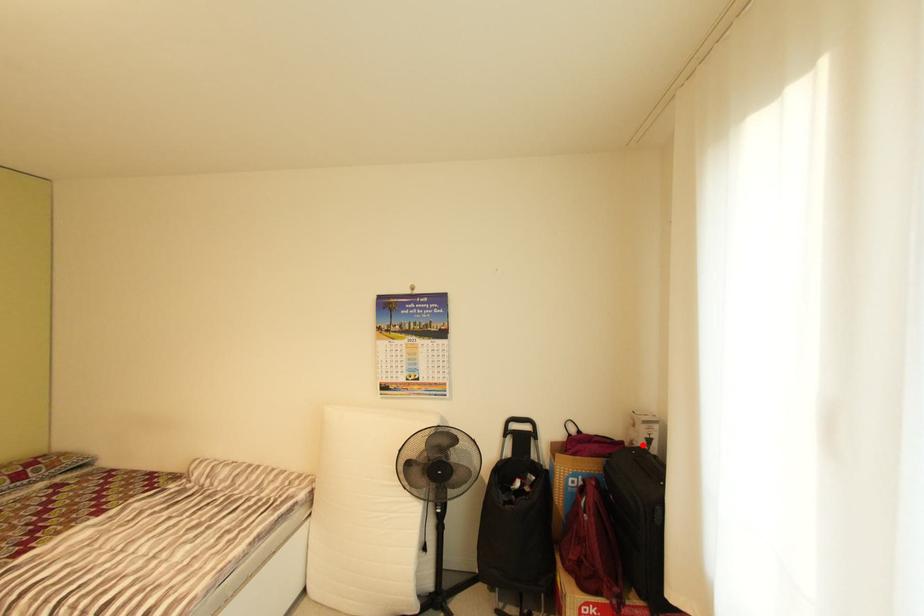
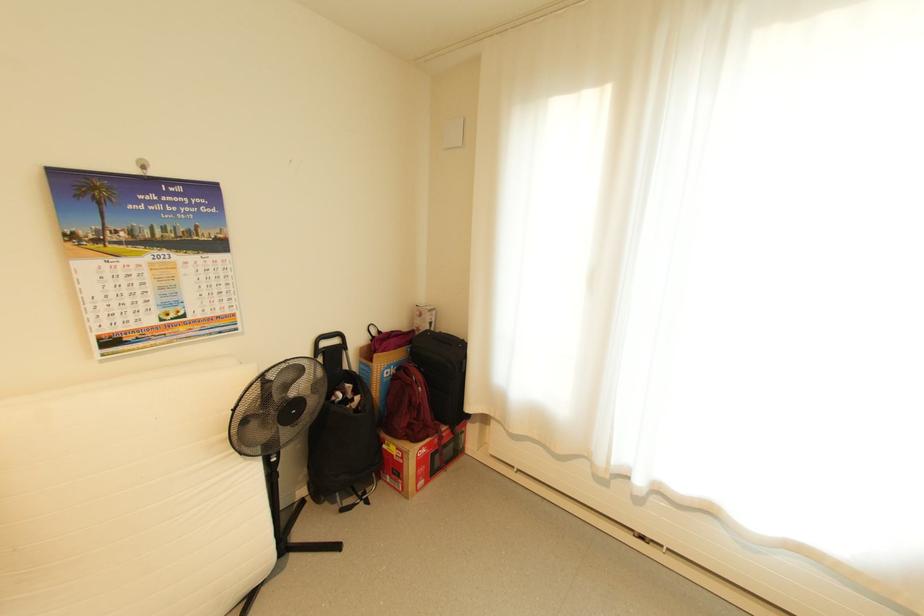
The point at the highlighted location is marked in the first image. Where is the corresponding point in the second image?

(429, 330)